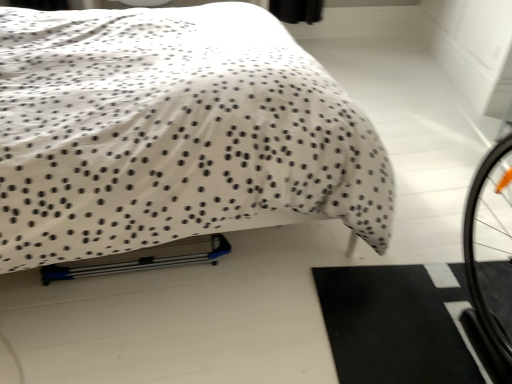
The image size is (512, 384). I want to click on white dotted fabric at upper left, so click(170, 132).

Describe the element at coordinates (170, 132) in the screenshot. I see `white dotted fabric at upper left` at that location.

Where is `white dotted fabric at upper left`? white dotted fabric at upper left is located at coordinates click(x=170, y=132).